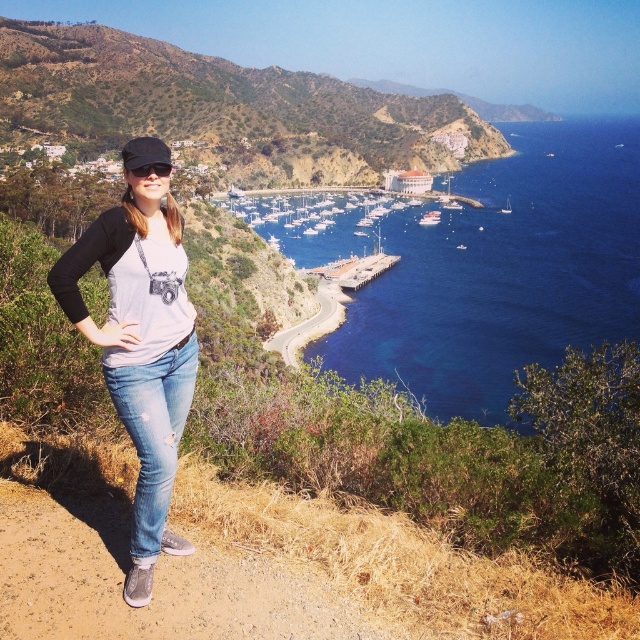
You are a photographer trying to capture a wide shot of the coastal scene. You need to ensure that both the green grassy hillside at upper left and the denim jeans at center are visible in your frame. Based on their widths, which object will occupy more horizontal space in the photo?

The green grassy hillside at upper left will occupy more horizontal space in the photo because its width surpasses that of the denim jeans at center.

You are a photographer positioned at the center of the scene. You want to capture a photo of the green grassy hillside at upper left without any obstructions. Considering the height difference between the hillside and your current position, will the denim jeans at center block your view of the hillside?

The green grassy hillside at upper left is much taller than the denim jeans at center, so the denim jeans at center will not block your view of the hillside since the hillside is significantly taller.